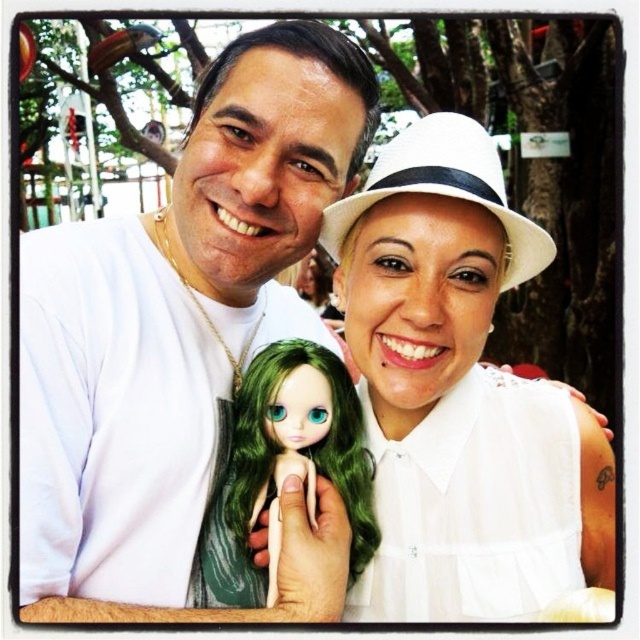
Based on the coordinates provided in the scene, where is the white pleated dress at center located?

The white pleated dress at center is located at the coordinates point (474, 506).

You are a photographer trying to capture a closeup of the green porcelain doll at center without the white matte hat at upper center blocking the view. Is this possible given their positions?

The white matte hat at upper center is in front of the green porcelain doll at center, so it will block the view. To capture a clear shot of the green porcelain doll at center, you need to move the white matte hat at upper center out of the way or adjust your angle to avoid it.